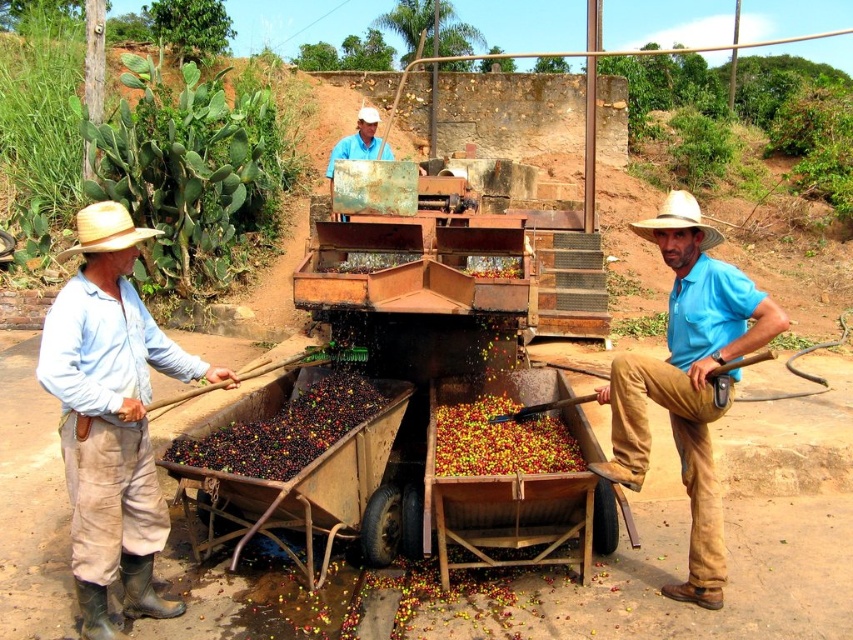
Does blue cotton shirt at center lie behind wooden cart at center?

No, blue cotton shirt at center is closer to the viewer.

Which is in front, point (727, 400) or point (604, 509)?

Point (727, 400) is in front.

Between point (692, 230) and point (511, 536), which one is positioned behind?

Positioned behind is point (511, 536).

You are a GUI agent. You are given a task and a screenshot of the screen. Output one action in this format:
    pyautogui.click(x=<x>, y=<y>)
    Task: Click on the blue cotton shirt at center
    The width and height of the screenshot is (853, 640).
    Given the screenshot: What is the action you would take?
    pyautogui.click(x=688, y=380)

Is wooden cart at center thinner than light blue shirt at center?

No.

In the scene shown: Which is above, wooden cart at center or light blue shirt at center?

light blue shirt at center is above.

You are a GUI agent. You are given a task and a screenshot of the screen. Output one action in this format:
    pyautogui.click(x=<x>, y=<y>)
    Task: Click on the wooden cart at center
    The height and width of the screenshot is (640, 853).
    Given the screenshot: What is the action you would take?
    pyautogui.click(x=514, y=492)

In the scene shown: Is wooden cart at center positioned before brown wooden cart at center?

No, it is not.

Is point (506, 561) farther from viewer compared to point (345, 438)?

No, it is not.

Where is `wooden cart at center`? Image resolution: width=853 pixels, height=640 pixels. wooden cart at center is located at coordinates (514, 492).